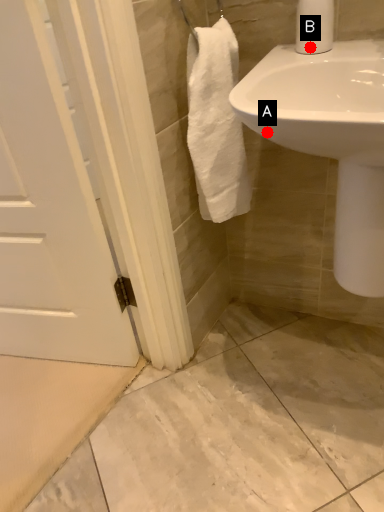
Question: Two points are circled on the image, labeled by A and B beside each circle. Which point is further to the camera?

Choices:
 (A) A is further
 (B) B is further

Answer: (B)